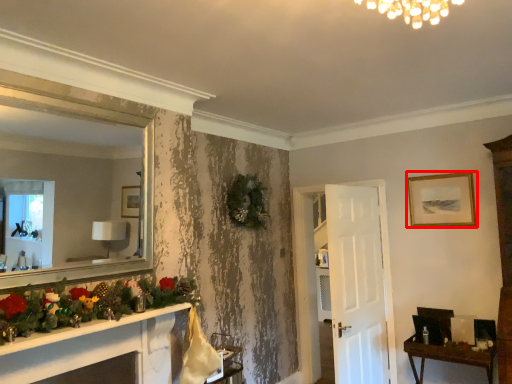
Question: From the image's perspective, where is picture frame (annotated by the red box) located relative to table?

Choices:
 (A) below
 (B) above

Answer: (B)